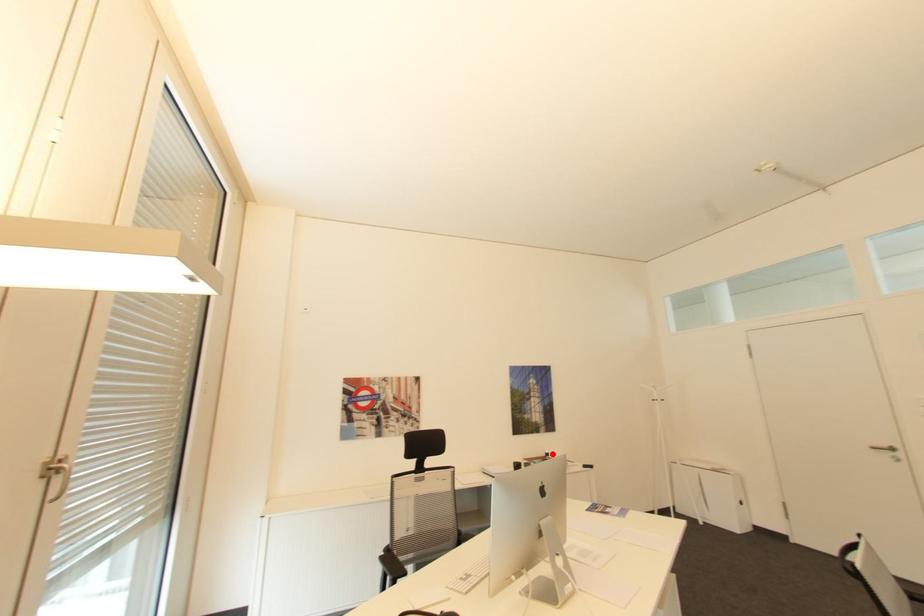
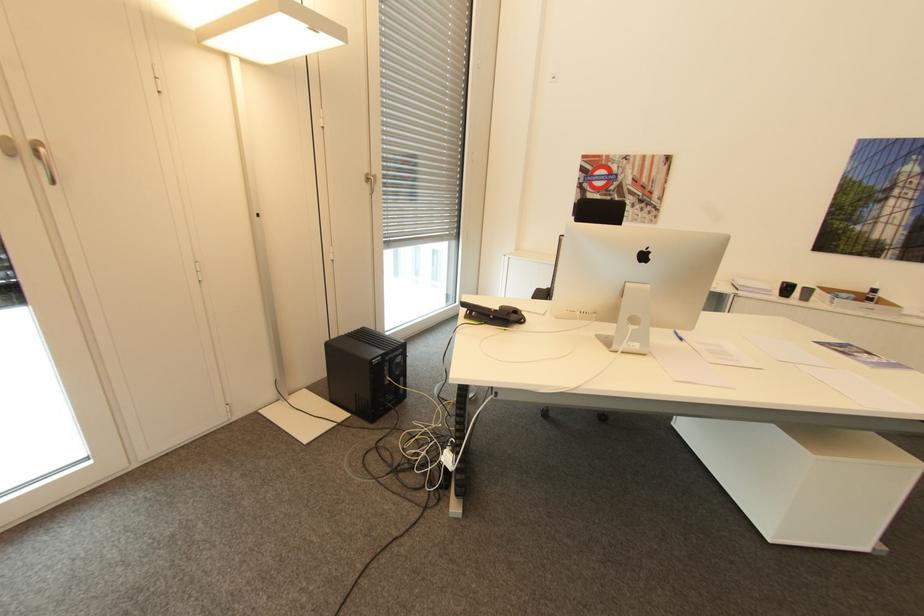
In the second image, find the point that corresponds to the highlighted location in the first image.

(879, 290)